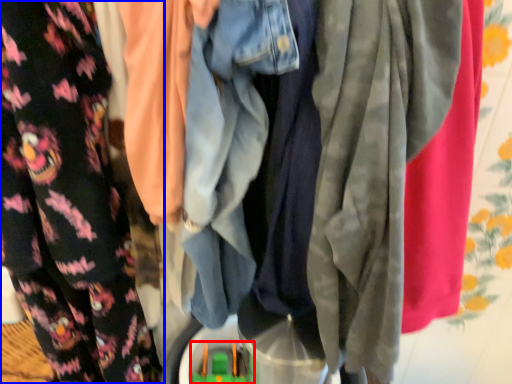
Question: Among these objects, which one is nearest to the camera, toy (highlighted by a red box) or fancy dress (highlighted by a blue box)?

Choices:
 (A) toy
 (B) fancy dress

Answer: (B)